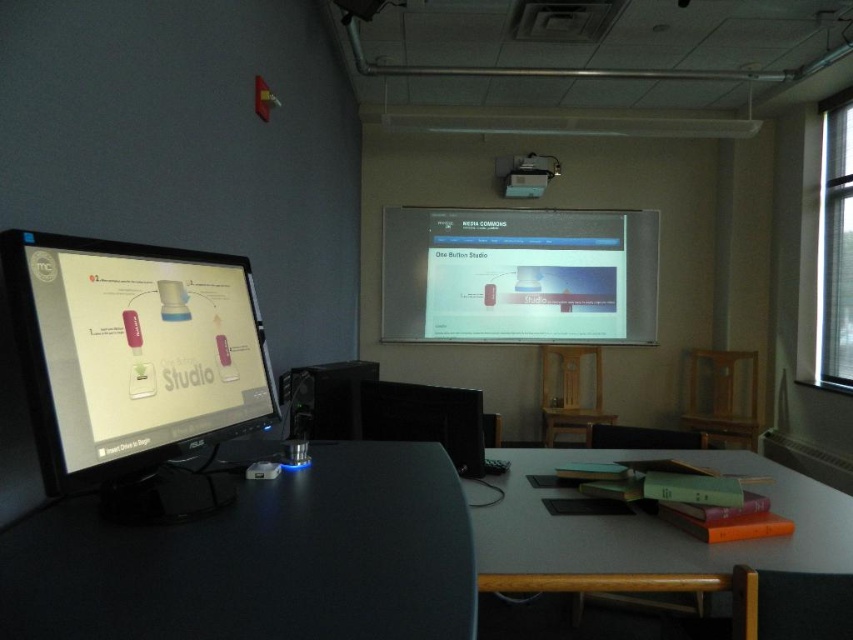
You are setting up a presentation and need to place a laptop between the matte black monitor at left and the smooth gray table at lower right. Considering their widths, which object should the laptop be placed closer to?

The laptop should be placed closer to the matte black monitor at left since it has a lesser width compared to the smooth gray table at lower right, providing enough space between them.